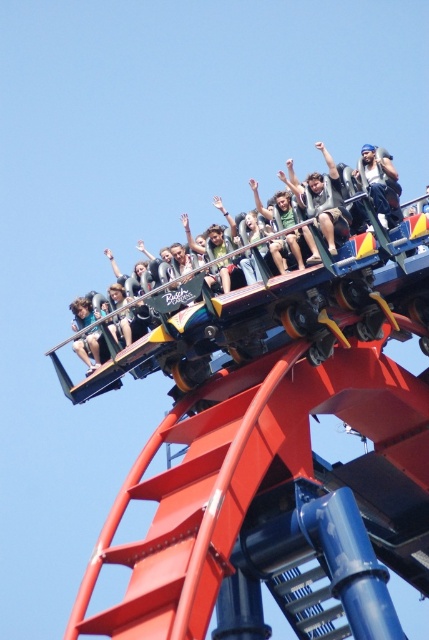
Which of these two, metallic roller coaster at upper center or denim jacket at upper center, stands shorter?

With less height is denim jacket at upper center.

Can you confirm if metallic roller coaster at upper center is positioned below denim jacket at upper center?

Yes, metallic roller coaster at upper center is below denim jacket at upper center.

This screenshot has width=429, height=640. What do you see at coordinates (274, 442) in the screenshot?
I see `metallic roller coaster at upper center` at bounding box center [274, 442].

The height and width of the screenshot is (640, 429). I want to click on metallic roller coaster at upper center, so click(274, 442).

Is metallic roller coaster at upper center to the right of black leather jacket at upper center from the viewer's perspective?

Yes, metallic roller coaster at upper center is to the right of black leather jacket at upper center.

Is metallic roller coaster at upper center below black leather jacket at upper center?

Indeed, metallic roller coaster at upper center is positioned under black leather jacket at upper center.

You are a GUI agent. You are given a task and a screenshot of the screen. Output one action in this format:
    pyautogui.click(x=<x>, y=<y>)
    Task: Click on the metallic roller coaster at upper center
    The image size is (429, 640).
    Given the screenshot: What is the action you would take?
    pyautogui.click(x=274, y=442)

Is black leather jacket at upper center wider than beige fabric shirt at center?

Correct, the width of black leather jacket at upper center exceeds that of beige fabric shirt at center.

Does black leather jacket at upper center lie in front of beige fabric shirt at center?

Yes, it is.

Locate an element on the screen. black leather jacket at upper center is located at coordinates (283, 280).